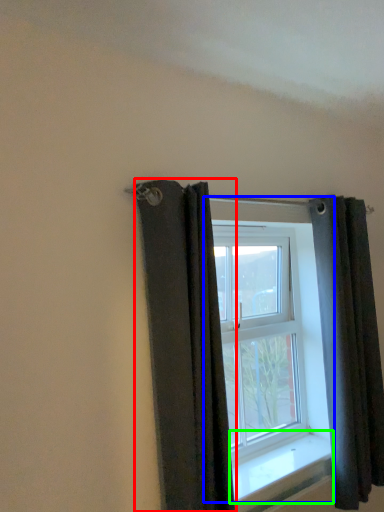
Question: Which is nearer to the curtain (highlighted by a red box)? window (highlighted by a blue box) or window sill (highlighted by a green box).

Choices:
 (A) window
 (B) window sill

Answer: (A)